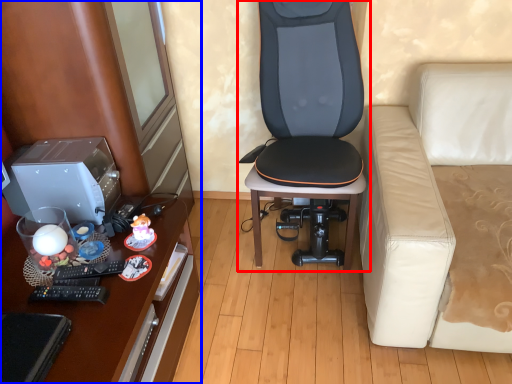
Question: Which object is further to the camera taking this photo, chair (highlighted by a red box) or dresser (highlighted by a blue box)?

Choices:
 (A) chair
 (B) dresser

Answer: (A)